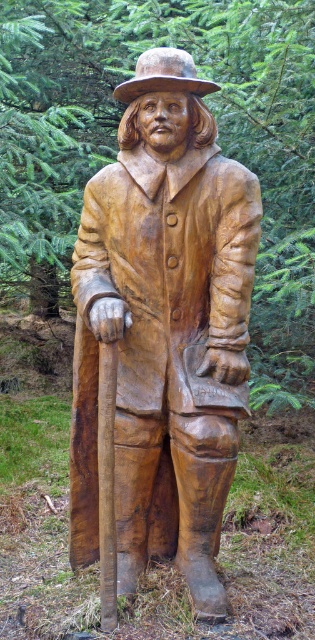
You are a painter standing in front of the wooden statue at center and the wooden textured hat at center. You want to know if you can fit both items side by side on a canvas that is 1 meter wide. Can you determine if they will fit?

The wooden statue at center might be wider than wooden textured hat at center, so it is uncertain if both will fit side by side on a 1 meter wide canvas without overlapping or exceeding the canvas width.

You are standing in a forest with coniferous trees. You see a wooden sculpture of a man wearing a wide brimmed hat, long coat with buttons, and knee high boots. There is a point at coordinate (164,328). What object is located at that coordinate?

The point at coordinate (164,328) corresponds to the wooden statue at center.

You are an artist planning to create a miniature version of the wooden statue at center and the wooden textured hat at center for a diorama. If you want both to be scaled down proportionally, which object should you focus on reducing in size first to maintain the correct proportions?

The wooden textured hat at center should be reduced in size first since the wooden statue at center is taller than the wooden textured hat at center, so scaling the hat appropriately will help maintain the correct proportions between them.